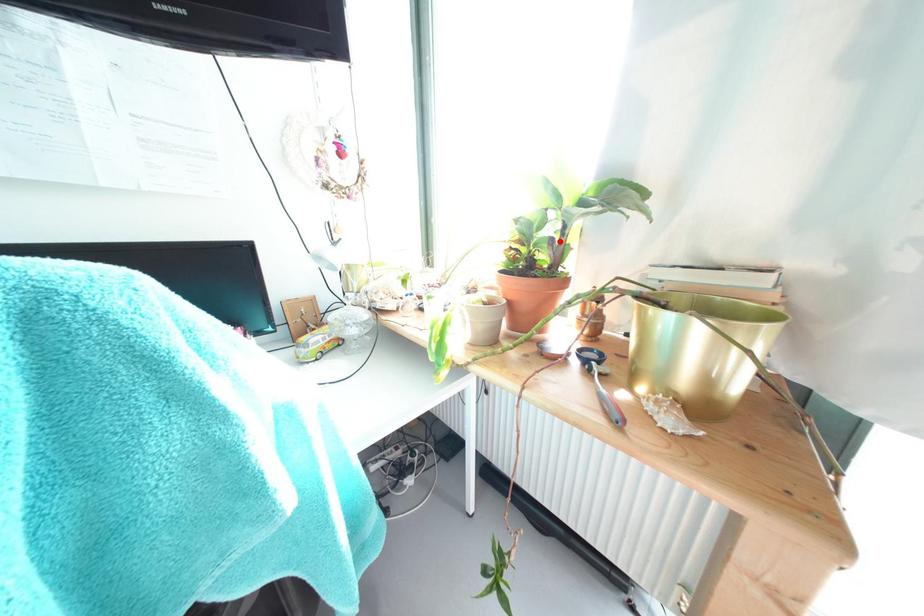
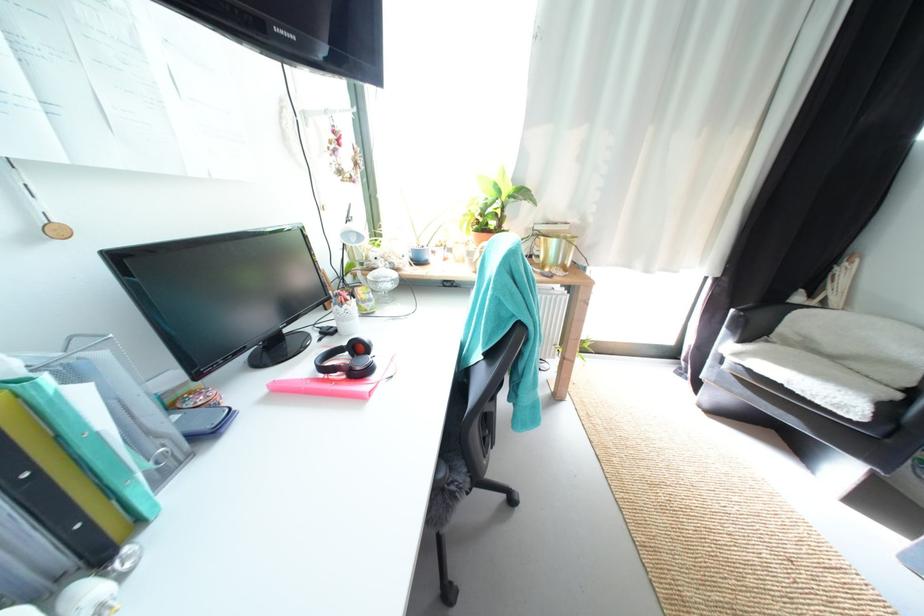
Where in the second image is the point corresponding to the highlighted location from the first image?

(505, 216)